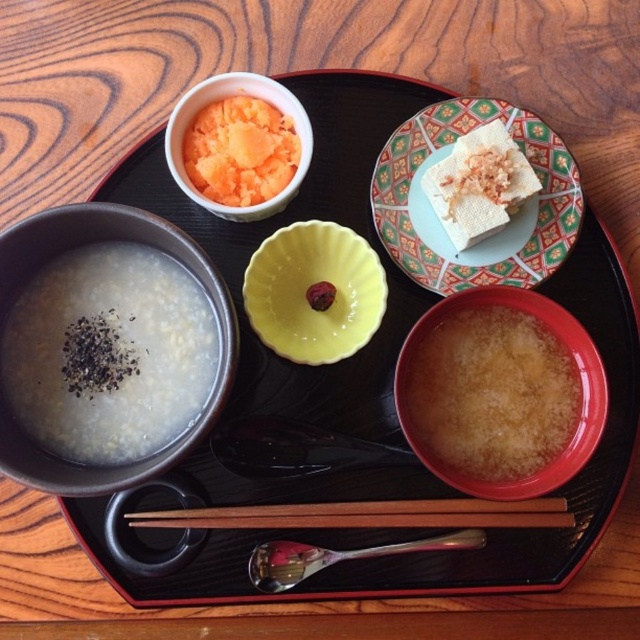
Question: Does matte brown bowl at bottom right have a smaller size compared to brown wood chopsticks at center?

Choices:
 (A) yes
 (B) no

Answer: (B)

Question: Does white matte bowl at lower left appear on the right side of yellow matte bowl at center?

Choices:
 (A) no
 (B) yes

Answer: (A)

Question: Among these objects, which one is farthest from the camera?

Choices:
 (A) white matte bowl at lower left
 (B) yellow matte bowl at center

Answer: (B)

Question: Which of the following is the closest to the observer?

Choices:
 (A) (602, 387)
 (B) (248, 275)
 (C) (468, 216)

Answer: (A)

Question: Among these objects, which one is farthest from the camera?

Choices:
 (A) matte orange bowl at upper left
 (B) white matte bowl at lower left

Answer: (A)

Question: Is white matte bowl at lower left to the right of brown wood chopsticks at center from the viewer's perspective?

Choices:
 (A) no
 (B) yes

Answer: (A)